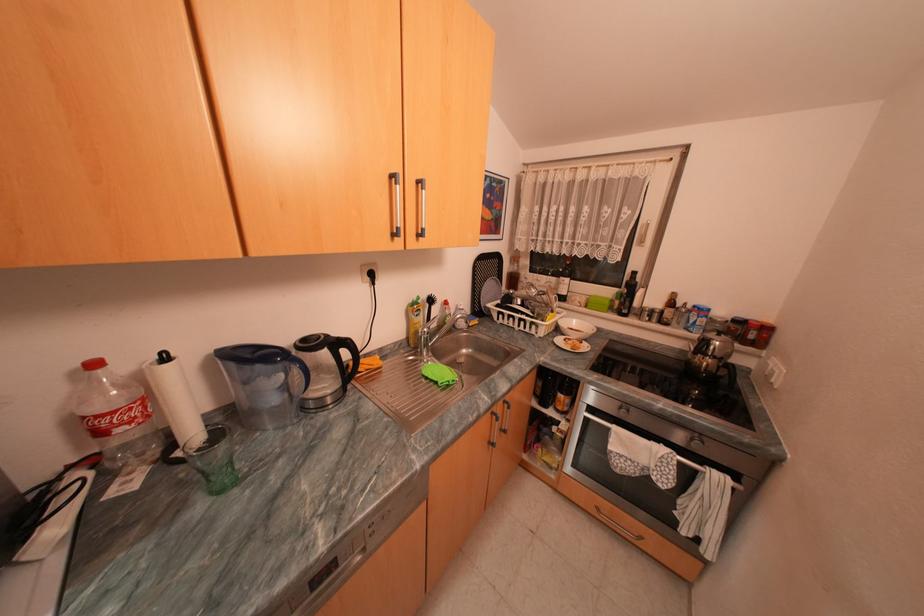
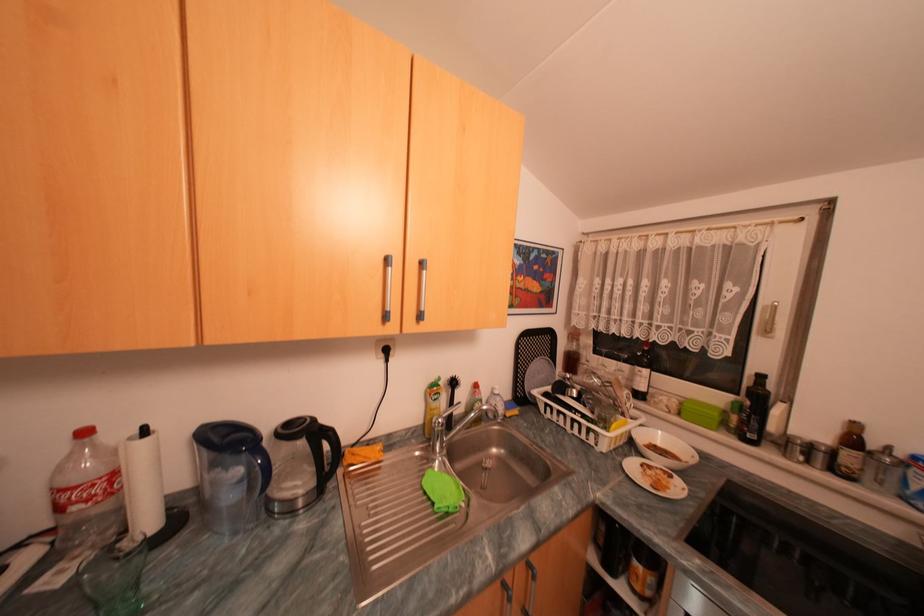
The point at (104, 363) is marked in the first image. Where is the corresponding point in the second image?

(94, 432)